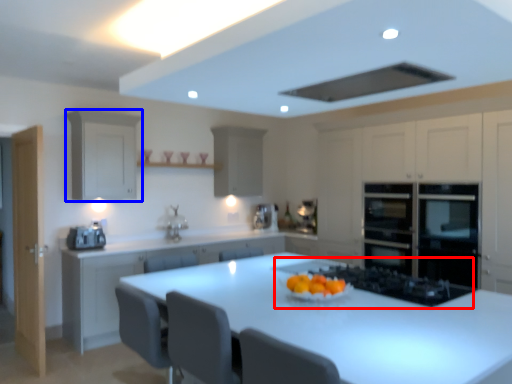
Question: Which object is closer to the camera taking this photo, gas stove (highlighted by a red box) or cabinetry (highlighted by a blue box)?

Choices:
 (A) gas stove
 (B) cabinetry

Answer: (A)